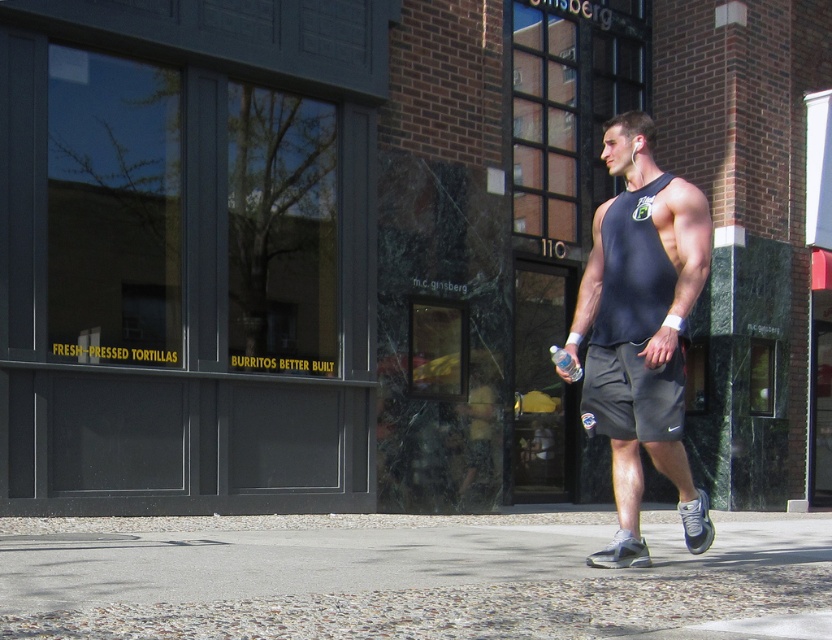
Is point (312, 515) more distant than point (677, 394)?

Yes.

Who is higher up, gray cobblestone pavement at lower center or gray fabric shorts at center?

gray fabric shorts at center is higher up.

Locate an element on the screen. This screenshot has width=832, height=640. gray cobblestone pavement at lower center is located at coordinates (410, 577).

Is point (18, 524) positioned after point (602, 253)?

Yes, point (18, 524) is farther from viewer.

Can you confirm if gray cobblestone pavement at lower center is thinner than matte black tank top at center?

Yes, gray cobblestone pavement at lower center is thinner than matte black tank top at center.

Is point (816, 618) closer to viewer compared to point (637, 202)?

Yes, it is in front of point (637, 202).

Locate an element on the screen. This screenshot has width=832, height=640. gray cobblestone pavement at lower center is located at coordinates (410, 577).

Between matte black tank top at center and gray fabric shorts at center, which one appears on the left side from the viewer's perspective?

Positioned to the left is gray fabric shorts at center.

Does matte black tank top at center appear under gray fabric shorts at center?

Incorrect, matte black tank top at center is not positioned below gray fabric shorts at center.

Looking at this image, who is more forward, (640, 115) or (654, 420)?

Point (654, 420) is more forward.

Find the location of `matte black tank top at center`. matte black tank top at center is located at coordinates (641, 330).